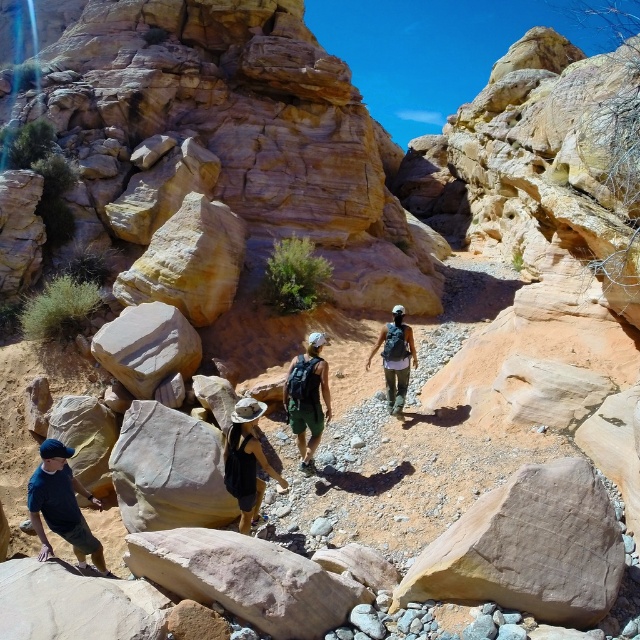
Does dark blue t-shirt at lower left have a greater width compared to brown fabric hat at center?

Incorrect, dark blue t-shirt at lower left's width does not surpass brown fabric hat at center's.

Who is more forward, (45, 451) or (250, 476)?

Point (45, 451)

Identify the location of dark blue t-shirt at lower left. This screenshot has width=640, height=640. (61, 506).

Who is positioned more to the right, brown fabric hat at center or matte black backpack at center?

matte black backpack at center is more to the right.

Is brown fabric hat at center shorter than matte black backpack at center?

Yes.

Between point (253, 408) and point (385, 376), which one is positioned behind?

Positioned behind is point (385, 376).

The width and height of the screenshot is (640, 640). Identify the location of brown fabric hat at center. (246, 461).

Does brown fabric hat at center come behind green fabric backpack at center?

No.

Does brown fabric hat at center have a greater width compared to green fabric backpack at center?

No, brown fabric hat at center is not wider than green fabric backpack at center.

Is point (243, 401) positioned behind point (301, 416)?

No, (243, 401) is closer to viewer.

Image resolution: width=640 pixels, height=640 pixels. I want to click on brown fabric hat at center, so click(246, 461).